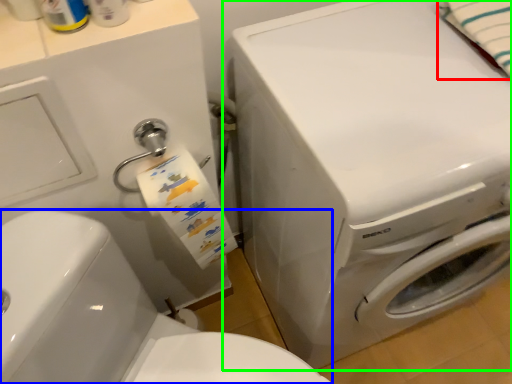
Question: Estimate the real-world distances between objects in this image. Which object is closer to bath towel (highlighted by a red box), washer (highlighted by a blue box) or washing machine (highlighted by a green box)?

Choices:
 (A) washer
 (B) washing machine

Answer: (B)